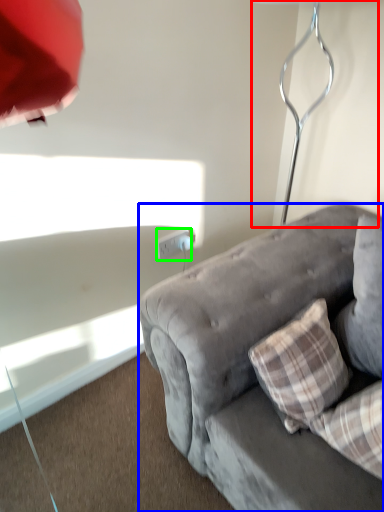
Question: Which object is positioned farthest from table lamp (highlighted by a red box)? Select from studio couch (highlighted by a blue box) and power outlet (highlighted by a green box).

Choices:
 (A) studio couch
 (B) power outlet

Answer: (B)